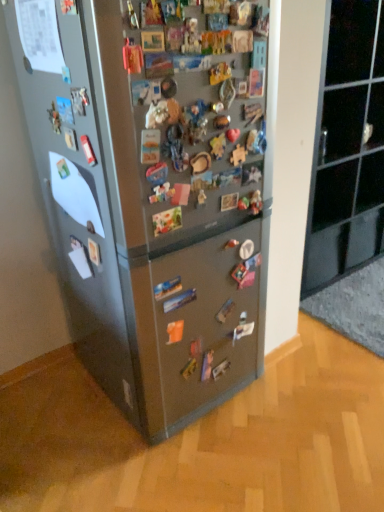
Question: Choose the correct answer: Is satin silver fridge at center inside black glass cabinet at upper right or outside it?

Choices:
 (A) outside
 (B) inside

Answer: (A)

Question: Looking at the image, does satin silver fridge at center seem bigger or smaller compared to black glass cabinet at upper right?

Choices:
 (A) small
 (B) big

Answer: (B)

Question: In terms of height, does satin silver fridge at center look taller or shorter compared to black glass cabinet at upper right?

Choices:
 (A) short
 (B) tall

Answer: (B)

Question: Is black glass cabinet at upper right taller or shorter than satin silver fridge at center?

Choices:
 (A) tall
 (B) short

Answer: (B)

Question: Does point (372, 161) appear closer or farther from the camera than point (122, 65)?

Choices:
 (A) farther
 (B) closer

Answer: (A)

Question: In the image, is black glass cabinet at upper right on the left side or the right side of satin silver fridge at center?

Choices:
 (A) right
 (B) left

Answer: (A)

Question: From the image's perspective, relative to satin silver fridge at center, is black glass cabinet at upper right above or below?

Choices:
 (A) below
 (B) above

Answer: (B)